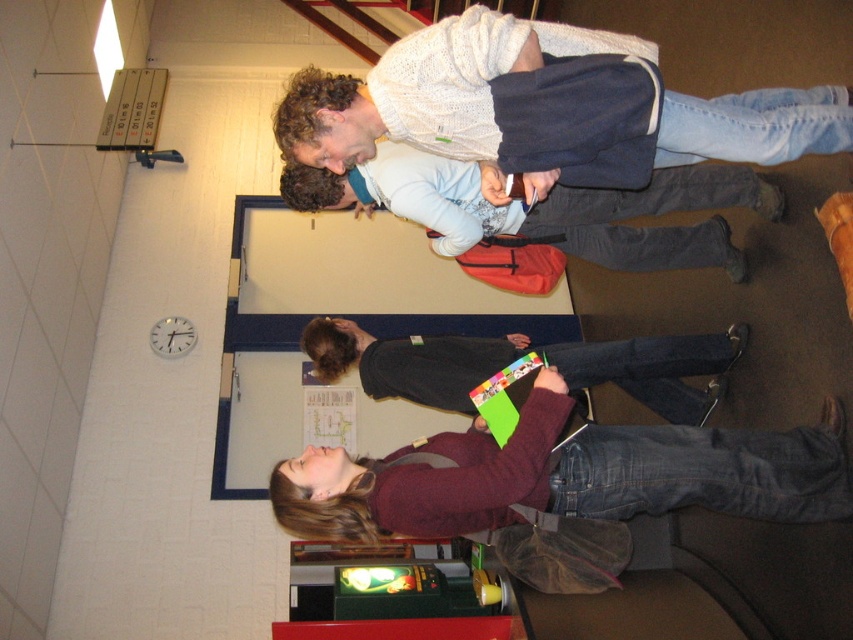
Does maroon fabric shirt at lower center have a greater height compared to knitted white sweater at upper center?

Yes.

Where is `maroon fabric shirt at lower center`? maroon fabric shirt at lower center is located at coordinates (561, 484).

Image resolution: width=853 pixels, height=640 pixels. Identify the location of maroon fabric shirt at lower center. (561, 484).

Is maroon fabric shirt at lower center positioned behind matte blue backpack at center?

No, it is not.

Can you confirm if maroon fabric shirt at lower center is shorter than matte blue backpack at center?

No.

Where is `maroon fabric shirt at lower center`? The width and height of the screenshot is (853, 640). maroon fabric shirt at lower center is located at coordinates (561, 484).

You are a GUI agent. You are given a task and a screenshot of the screen. Output one action in this format:
    pyautogui.click(x=<x>, y=<y>)
    Task: Click on the maroon fabric shirt at lower center
    The height and width of the screenshot is (640, 853).
    Given the screenshot: What is the action you would take?
    pyautogui.click(x=561, y=484)

Is maroon fabric shirt at lower center taller than dark gray sweater at center?

Correct, maroon fabric shirt at lower center is much taller as dark gray sweater at center.

Which is more to the left, maroon fabric shirt at lower center or dark gray sweater at center?

Positioned to the left is dark gray sweater at center.

Who is more forward, (335, 502) or (451, 400)?

Positioned in front is point (335, 502).

The image size is (853, 640). Identify the location of maroon fabric shirt at lower center. (561, 484).